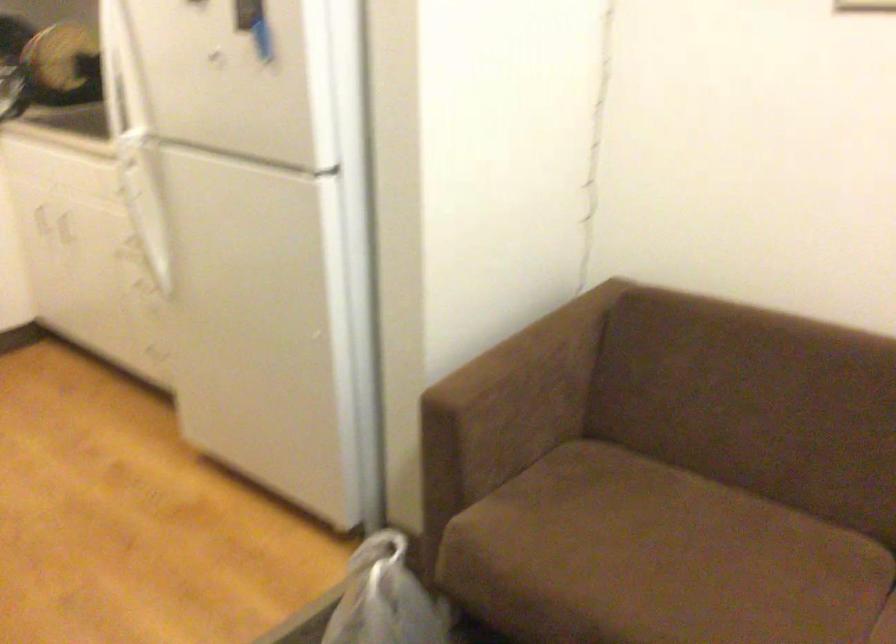
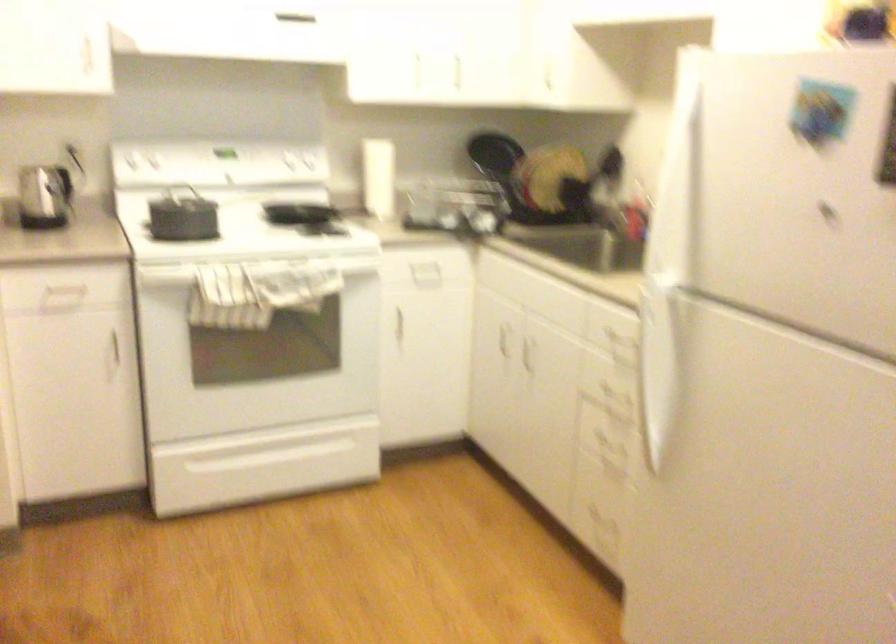
Question: How did the camera likely rotate?

Choices:
 (A) Left
 (B) Right
 (C) Up
 (D) Down

Answer: (A)